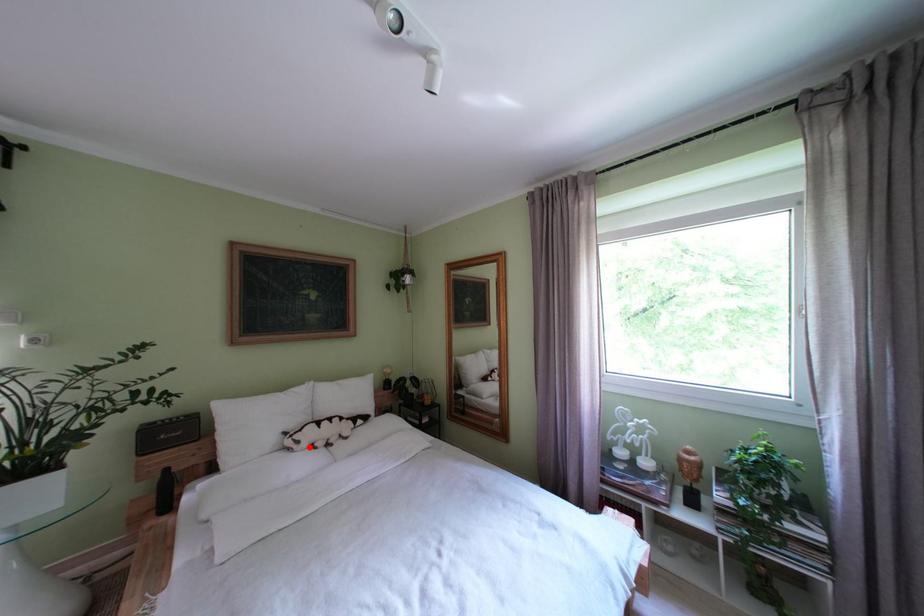
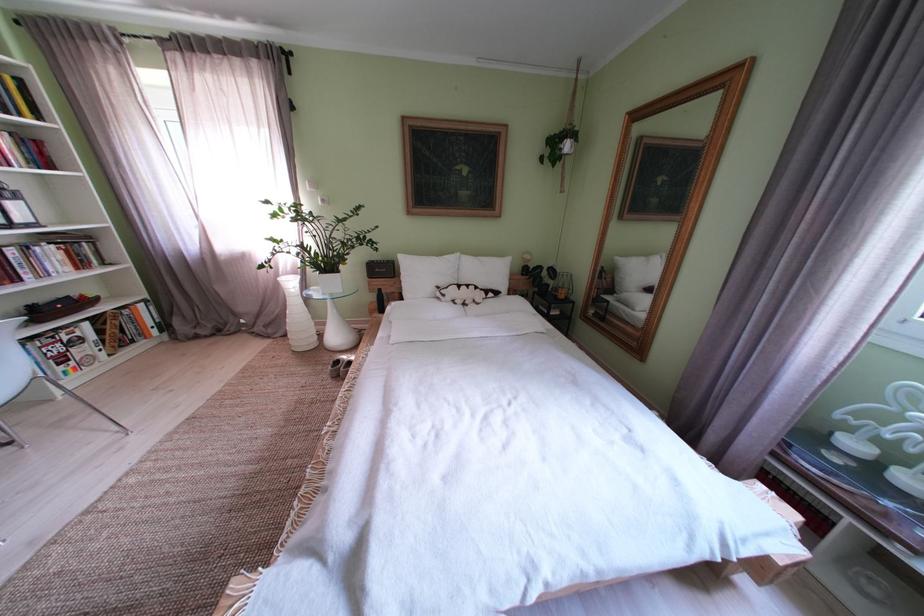
Where in the second image is the point corresponding to the highlighted location from the first image?

(455, 301)